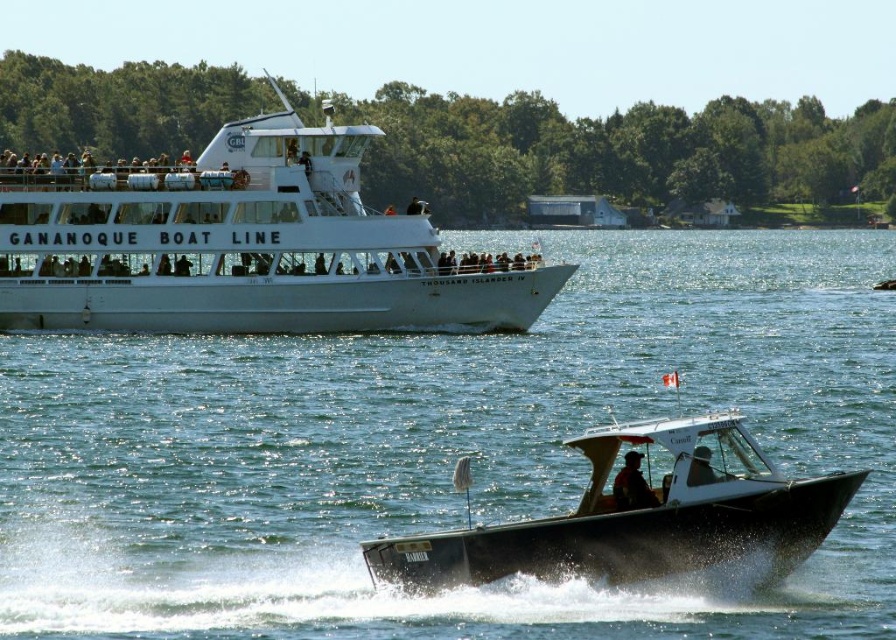
Between white glossy boat at upper center and metallic gray boat at lower center, which one has more height?

white glossy boat at upper center is taller.

Between white glossy boat at upper center and metallic gray boat at lower center, which one appears on the right side from the viewer's perspective?

Positioned to the right is metallic gray boat at lower center.

Where is `white glossy boat at upper center`? Image resolution: width=896 pixels, height=640 pixels. white glossy boat at upper center is located at coordinates [x=243, y=243].

Locate an element on the screen. white glossy boat at upper center is located at coordinates (243, 243).

Where is `clear blue water at center`? clear blue water at center is located at coordinates (444, 449).

Is point (481, 461) closer to camera compared to point (626, 465)?

That is False.

Locate an element on the screen. This screenshot has width=896, height=640. clear blue water at center is located at coordinates (444, 449).

How much distance is there between metallic gray boat at lower center and orange fabric jacket at lower center?

The distance of metallic gray boat at lower center from orange fabric jacket at lower center is 3.93 meters.

Who is more forward, (694, 486) or (653, 504)?

Positioned in front is point (694, 486).

Between point (607, 509) and point (631, 468), which one is positioned in front?

Point (607, 509) is in front.

Where is `metallic gray boat at lower center`? metallic gray boat at lower center is located at coordinates (638, 515).